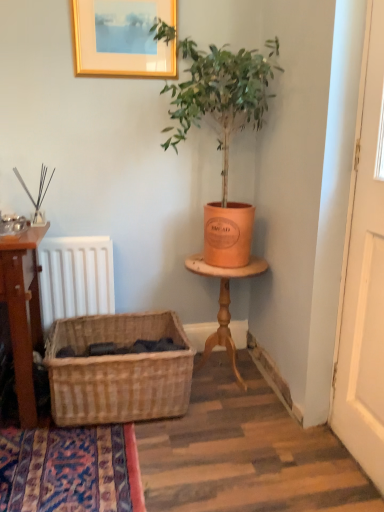
Question: From the image's perspective, is woven natural basket at lower left beneath white wooden door at right?

Choices:
 (A) yes
 (B) no

Answer: (A)

Question: Can you confirm if woven natural basket at lower left is positioned to the left of white wooden door at right?

Choices:
 (A) yes
 (B) no

Answer: (A)

Question: Is the depth of woven natural basket at lower left greater than that of white wooden door at right?

Choices:
 (A) no
 (B) yes

Answer: (B)

Question: Can you confirm if woven natural basket at lower left is taller than white wooden door at right?

Choices:
 (A) yes
 (B) no

Answer: (B)

Question: Is woven natural basket at lower left in contact with white wooden door at right?

Choices:
 (A) no
 (B) yes

Answer: (A)

Question: Is gold wooden picture frame at upper center bigger or smaller than wooden table at right?

Choices:
 (A) big
 (B) small

Answer: (B)

Question: From the image's perspective, is gold wooden picture frame at upper center located above or below wooden table at right?

Choices:
 (A) above
 (B) below

Answer: (A)

Question: Is point (84, 57) closer or farther from the camera than point (243, 387)?

Choices:
 (A) closer
 (B) farther

Answer: (A)

Question: Is gold wooden picture frame at upper center wider or thinner than wooden table at right?

Choices:
 (A) thin
 (B) wide

Answer: (A)

Question: From their relative heights in the image, would you say woven natural basket at lower left is taller or shorter than gold wooden picture frame at upper center?

Choices:
 (A) tall
 (B) short

Answer: (B)

Question: Is point (84, 420) positioned closer to the camera than point (153, 53)?

Choices:
 (A) farther
 (B) closer

Answer: (B)

Question: From a real-world perspective, is woven natural basket at lower left above or below gold wooden picture frame at upper center?

Choices:
 (A) below
 (B) above

Answer: (A)

Question: Is woven natural basket at lower left situated inside gold wooden picture frame at upper center or outside?

Choices:
 (A) outside
 (B) inside

Answer: (A)

Question: Is orange clay pot at upper right inside the boundaries of gold wooden picture frame at upper center, or outside?

Choices:
 (A) outside
 (B) inside

Answer: (A)

Question: Considering the positions of point (226, 126) and point (160, 44), is point (226, 126) closer or farther from the camera than point (160, 44)?

Choices:
 (A) closer
 (B) farther

Answer: (B)